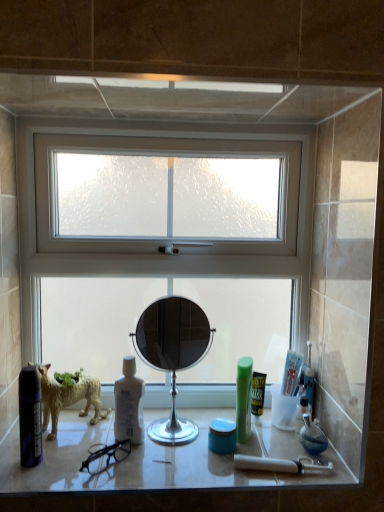
The image size is (384, 512). I want to click on vacant space to the left of green plastic bottle at center-right, so click(x=179, y=445).